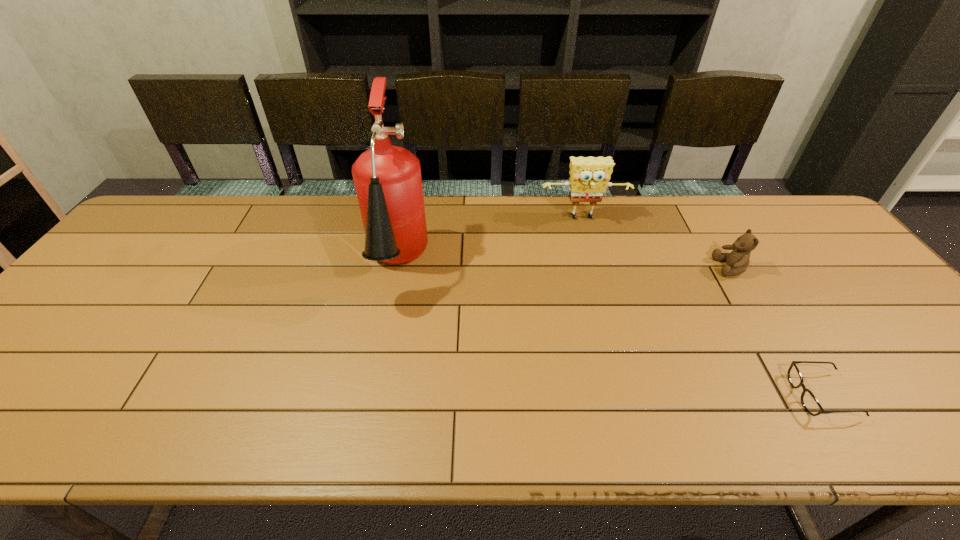
Where is `vacant space at the left edge`? The height and width of the screenshot is (540, 960). vacant space at the left edge is located at coordinates (85, 301).

Find the location of a particular element. The image size is (960, 540). vacant area at the right edge is located at coordinates (918, 382).

This screenshot has width=960, height=540. What are the coordinates of `free region at the far left corner of the desktop` in the screenshot? It's located at (162, 227).

I want to click on free space between the shortest object and the third shortest object, so click(703, 307).

Identify the location of vacant space that's between the second object from left to right and the tallest object. This screenshot has height=540, width=960. coord(490,243).

The width and height of the screenshot is (960, 540). I want to click on vacant space that's between the tallest object and the shortest object, so click(610, 331).

You are a GUI agent. You are given a task and a screenshot of the screen. Output one action in this format:
    pyautogui.click(x=<x>, y=<y>)
    Task: Click on the vacant space that's between the second object from left to right and the leftmost object
    This screenshot has height=540, width=960.
    Given the screenshot: What is the action you would take?
    pyautogui.click(x=490, y=243)

Locate an element on the screen. The width and height of the screenshot is (960, 540). unoccupied position between the third tallest object and the second object from left to right is located at coordinates (657, 243).

Image resolution: width=960 pixels, height=540 pixels. I want to click on free space between the third tallest object and the spectacles, so click(777, 332).

Where is `vacant space that's between the fire extinguisher and the farthest object`? The width and height of the screenshot is (960, 540). vacant space that's between the fire extinguisher and the farthest object is located at coordinates click(x=490, y=243).